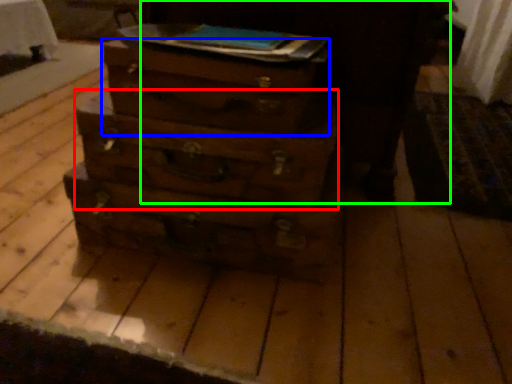
Question: Which is nearer to the drawer (highlighted by a red box)? drawer (highlighted by a blue box) or dark (highlighted by a green box).

Choices:
 (A) drawer
 (B) dark

Answer: (A)